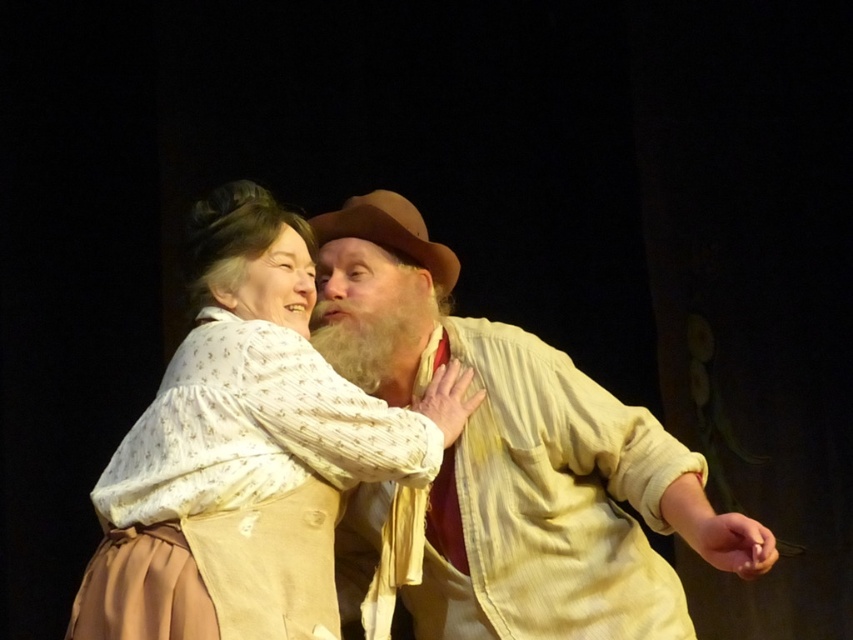
Question: Considering the relative positions of matte white blouse at center and brown felt cowboy hat at center in the image provided, where is matte white blouse at center located with respect to brown felt cowboy hat at center?

Choices:
 (A) above
 (B) below

Answer: (B)

Question: Is beige textured shirt at center positioned at the back of matte white blouse at center?

Choices:
 (A) no
 (B) yes

Answer: (A)

Question: Which object is the farthest from the brown felt cowboy hat at center?

Choices:
 (A) matte white blouse at center
 (B) beige textured shirt at center

Answer: (A)

Question: Does beige textured shirt at center appear over brown felt cowboy hat at center?

Choices:
 (A) yes
 (B) no

Answer: (B)

Question: Which point appears farthest from the camera in this image?

Choices:
 (A) (138, 445)
 (B) (321, 240)

Answer: (B)

Question: Among these objects, which one is nearest to the camera?

Choices:
 (A) matte white blouse at center
 (B) beige textured shirt at center

Answer: (B)